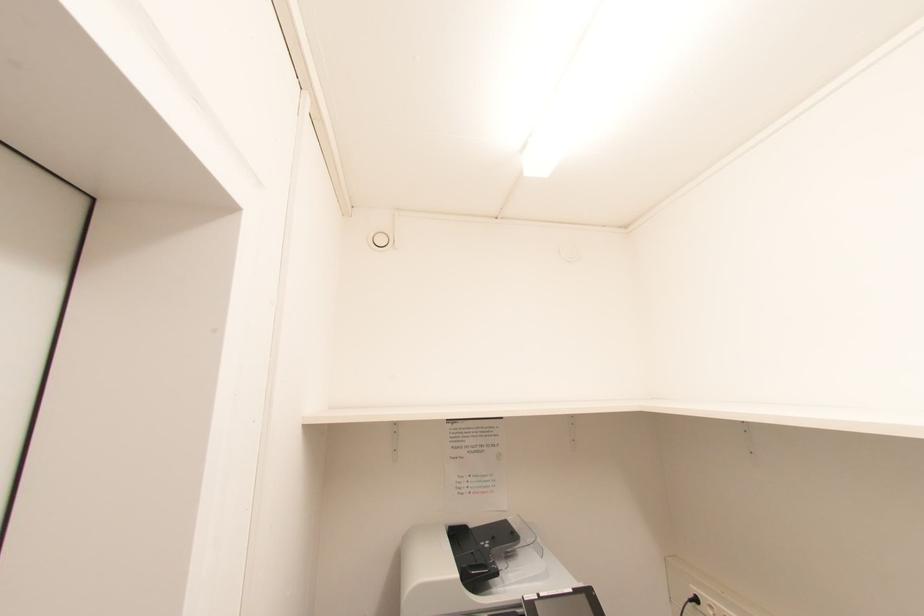
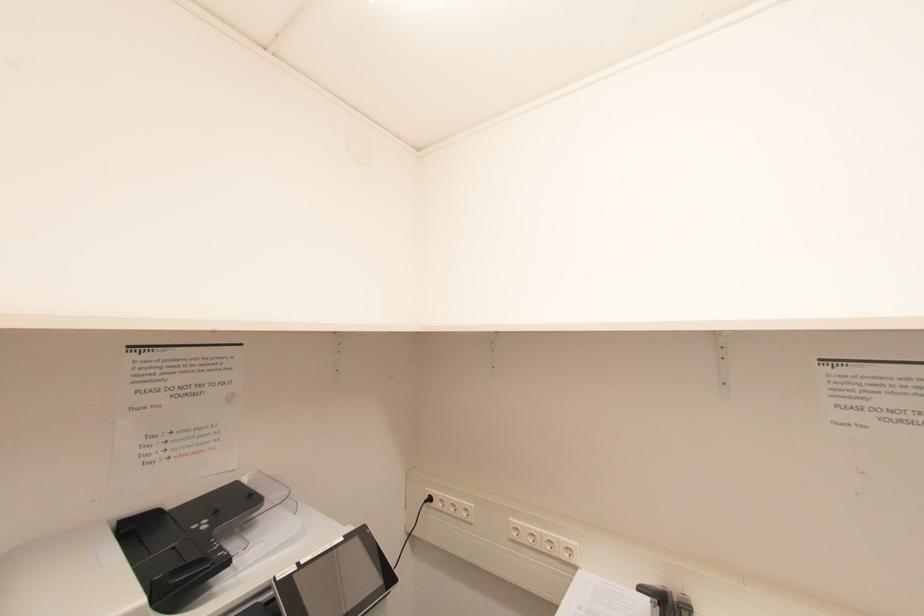
Question: The images are taken continuously from a first-person perspective. In which direction is your viewpoint rotating?

Choices:
 (A) Left
 (B) Right
 (C) Up
 (D) Down

Answer: (B)